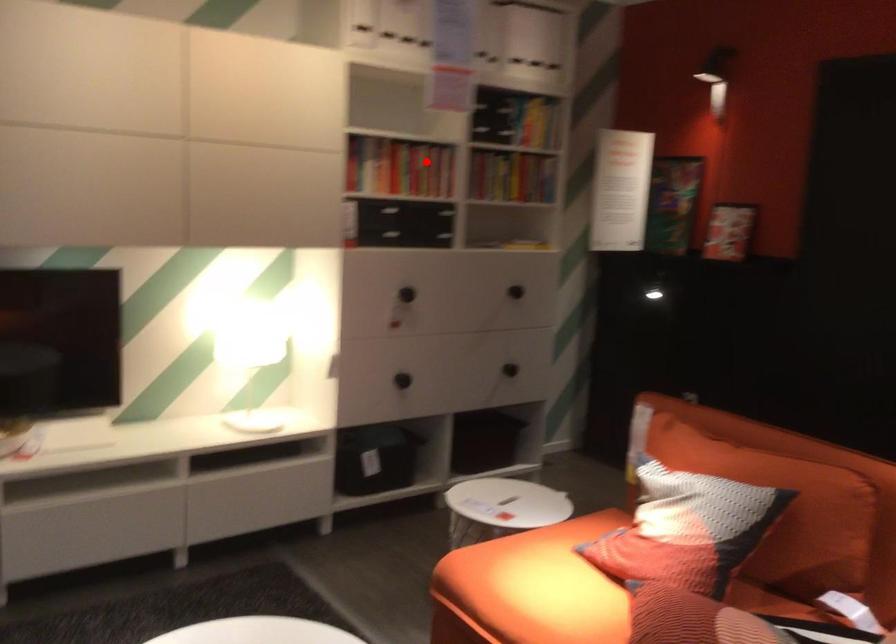
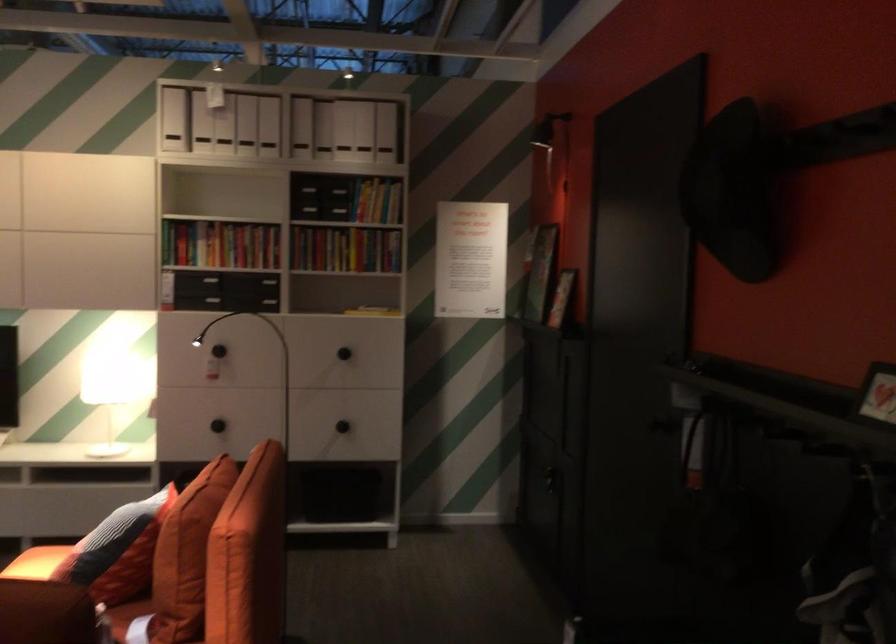
Question: I am providing you with two images of the same scene from different viewpoints. A red point is marked on the first image. Is the red point's position out of view in image 2?

Choices:
 (A) Yes
 (B) No

Answer: (B)